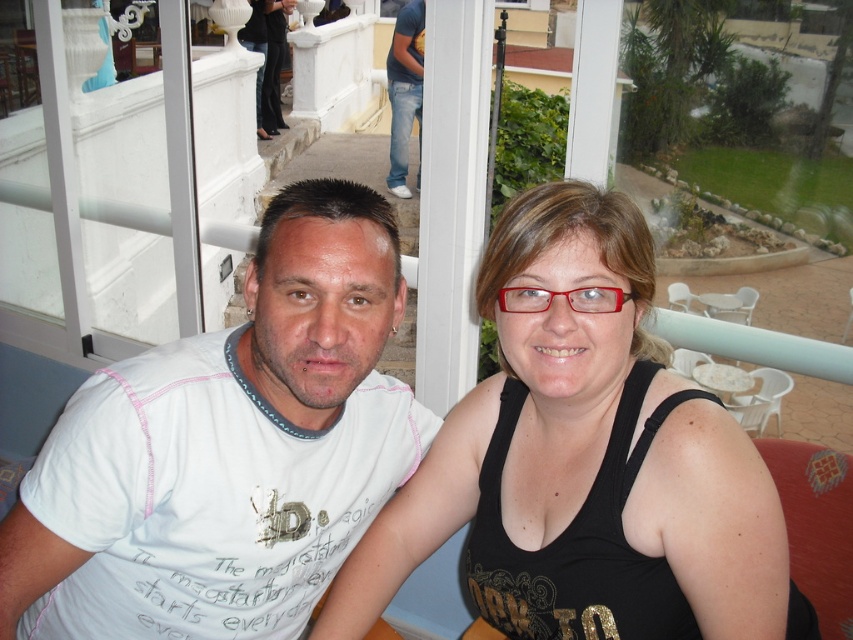
Which is in front, point (141, 598) or point (602, 346)?

Point (602, 346) is more forward.

Who is positioned more to the right, white cotton t-shirt at left or black matte tank top at center?

From the viewer's perspective, black matte tank top at center appears more on the right side.

Locate an element on the screen. This screenshot has width=853, height=640. white cotton t-shirt at left is located at coordinates (227, 449).